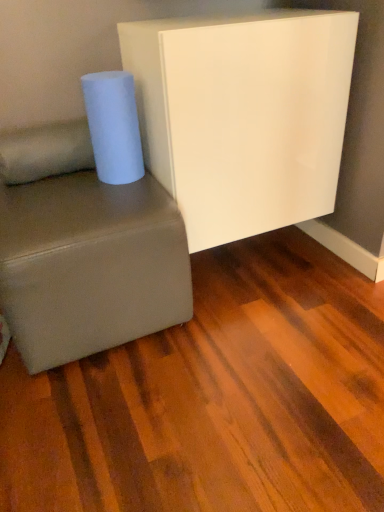
This screenshot has width=384, height=512. I want to click on soft beige fabric pillow at lower left, so click(x=45, y=151).

From the picture: Measure the distance between point (165, 291) and camera.

4.06 feet.

Locate an element on the screen. This screenshot has width=384, height=512. soft beige fabric pillow at lower left is located at coordinates (45, 151).

From a real-world perspective, which object rests below the other?

soft beige fabric pillow at lower left, from a real-world perspective.

Would you say soft beige fabric pillow at lower left is part of white matte paper towel at left's contents?

That's incorrect, soft beige fabric pillow at lower left is not inside white matte paper towel at left.

Which is in front, white matte paper towel at left or soft beige fabric pillow at lower left?

white matte paper towel at left is closer to the camera.

Considering the relative sizes of white matte paper towel at left and soft beige fabric pillow at lower left in the image provided, is white matte paper towel at left shorter than soft beige fabric pillow at lower left?

Incorrect, the height of white matte paper towel at left does not fall short of that of soft beige fabric pillow at lower left.

From a real-world perspective, is white glossy board at upper center above or below white matte paper towel at left?

white glossy board at upper center is below white matte paper towel at left.

The height and width of the screenshot is (512, 384). In order to click on paper towel that appears on the left of white glossy board at upper center in this screenshot , I will do point(113,126).

In terms of height, does white glossy board at upper center look taller or shorter compared to white matte paper towel at left?

Result: In the image, white glossy board at upper center appears to be taller than white matte paper towel at left.

Can you confirm if white glossy board at upper center is positioned to the right of white matte paper towel at left?

Correct, you'll find white glossy board at upper center to the right of white matte paper towel at left.

Are white glossy board at upper center and soft beige fabric pillow at lower left located far from each other?

→ No, white glossy board at upper center is not far from soft beige fabric pillow at lower left.

Who is more distant, white glossy board at upper center or soft beige fabric pillow at lower left?

soft beige fabric pillow at lower left is further away from the camera.

Between white glossy board at upper center and soft beige fabric pillow at lower left, which one appears on the right side from the viewer's perspective?

white glossy board at upper center.

Does white glossy board at upper center have a greater height compared to soft beige fabric pillow at lower left?

Indeed, white glossy board at upper center has a greater height compared to soft beige fabric pillow at lower left.

From the image's perspective, which object appears higher, soft beige fabric pillow at lower left or white matte paper towel at left?

white matte paper towel at left, from the image's perspective.

Is point (7, 178) closer or farther from the camera than point (127, 143)?

Point (7, 178) is farther from the camera than point (127, 143).

Based on their sizes in the image, would you say soft beige fabric pillow at lower left is bigger or smaller than white matte paper towel at left?

Considering their sizes, soft beige fabric pillow at lower left takes up more space than white matte paper towel at left.

From a real-world perspective, which object rests below the other?

In real-world perspective, suede-like gray studio couch at lower left is lower.

Does white matte paper towel at left have a greater height compared to suede-like gray studio couch at lower left?

In fact, white matte paper towel at left may be shorter than suede-like gray studio couch at lower left.

Does point (99, 133) lie behind point (90, 292)?

Yes, it is behind point (90, 292).

Can you confirm if white matte paper towel at left is bigger than suede-like gray studio couch at lower left?

No, white matte paper towel at left is not bigger than suede-like gray studio couch at lower left.

From a real-world perspective, between soft beige fabric pillow at lower left and suede-like gray studio couch at lower left, who is vertically higher?

In real-world perspective, soft beige fabric pillow at lower left is above.

Is soft beige fabric pillow at lower left located outside suede-like gray studio couch at lower left?

Absolutely, soft beige fabric pillow at lower left is external to suede-like gray studio couch at lower left.

From the image's perspective, which is above, soft beige fabric pillow at lower left or suede-like gray studio couch at lower left?

soft beige fabric pillow at lower left is shown above in the image.

Does soft beige fabric pillow at lower left have a larger size compared to suede-like gray studio couch at lower left?

No.

Does point (151, 225) come behind point (0, 150)?

No, (151, 225) is closer to viewer.

Is suede-like gray studio couch at lower left positioned beyond the bounds of soft beige fabric pillow at lower left?

Indeed, suede-like gray studio couch at lower left is completely outside soft beige fabric pillow at lower left.

Find the location of `studio couch below the soft beige fabric pillow at lower left (from the image's perspective)`. studio couch below the soft beige fabric pillow at lower left (from the image's perspective) is located at coordinates [x=83, y=250].

Is suede-like gray studio couch at lower left facing away from soft beige fabric pillow at lower left?

That's not correct — suede-like gray studio couch at lower left is not looking away from soft beige fabric pillow at lower left.

Locate an element on the screen. The height and width of the screenshot is (512, 384). pillow below the white matte paper towel at left (from the image's perspective) is located at coordinates (45, 151).

What are the coordinates of `furniture on the right of white matte paper towel at left` in the screenshot? It's located at (243, 116).

When comparing their distances from white glossy board at upper center, does white matte paper towel at left or suede-like gray studio couch at lower left seem closer?

white matte paper towel at left.

When comparing their distances from suede-like gray studio couch at lower left, does white matte paper towel at left or white glossy board at upper center seem further?

white glossy board at upper center.

Looking at this image, when comparing their distances from soft beige fabric pillow at lower left, does white glossy board at upper center or white matte paper towel at left seem further?

white glossy board at upper center is positioned further to the anchor soft beige fabric pillow at lower left.

Estimate the real-world distances between objects in this image. Which object is closer to white matte paper towel at left, soft beige fabric pillow at lower left or white glossy board at upper center?

soft beige fabric pillow at lower left is closer to white matte paper towel at left.

Based on the photo, considering their positions, is suede-like gray studio couch at lower left positioned closer to soft beige fabric pillow at lower left than white glossy board at upper center?

Based on the image, suede-like gray studio couch at lower left appears to be nearer to soft beige fabric pillow at lower left.

Which object lies further to the anchor point white glossy board at upper center, white matte paper towel at left or soft beige fabric pillow at lower left?

Based on the image, soft beige fabric pillow at lower left appears to be further to white glossy board at upper center.

Estimate the real-world distances between objects in this image. Which object is further from soft beige fabric pillow at lower left, white matte paper towel at left or white glossy board at upper center?

white glossy board at upper center is positioned further to the anchor soft beige fabric pillow at lower left.

From the picture: When comparing their distances from white matte paper towel at left, does soft beige fabric pillow at lower left or suede-like gray studio couch at lower left seem closer?

Among the two, soft beige fabric pillow at lower left is located nearer to white matte paper towel at left.

Locate an element on the screen. This screenshot has height=512, width=384. paper towel between soft beige fabric pillow at lower left and white glossy board at upper center is located at coordinates point(113,126).

At what (x,y) coordinates should I click in order to perform the action: click on paper towel located between suede-like gray studio couch at lower left and white glossy board at upper center in the left-right direction. Please return your answer as a coordinate pair (x, y). Looking at the image, I should click on (113, 126).

Locate an element on the screen. This screenshot has width=384, height=512. pillow that lies between white matte paper towel at left and suede-like gray studio couch at lower left from top to bottom is located at coordinates (45, 151).

What are the coordinates of `studio couch situated between soft beige fabric pillow at lower left and white glossy board at upper center from left to right` in the screenshot? It's located at (83, 250).